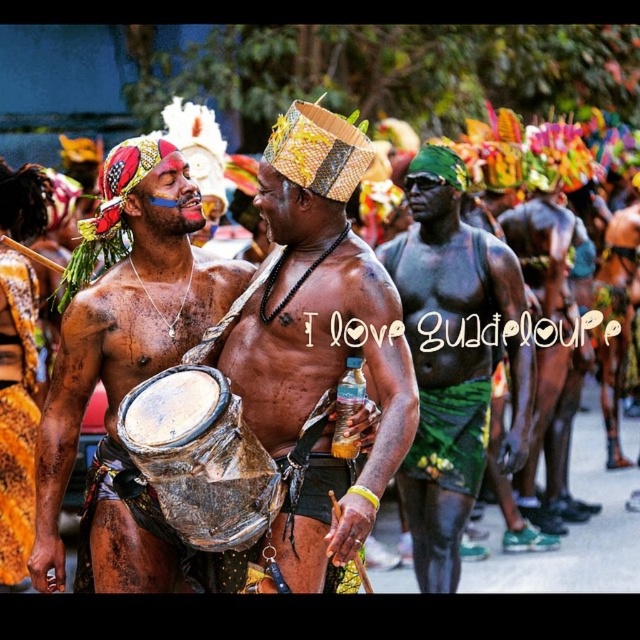
You are a photographer at the festival wanting to capture both the shiny metallic drum at center and the green textured fabric at center in the same frame. Which object should you focus on first to ensure both are in the shot?

The shiny metallic drum at center is shorter than the green textured fabric at center. To include both in the frame, focus on the shiny metallic drum at center first as it is lower, allowing the taller green textured fabric at center to naturally come into view.